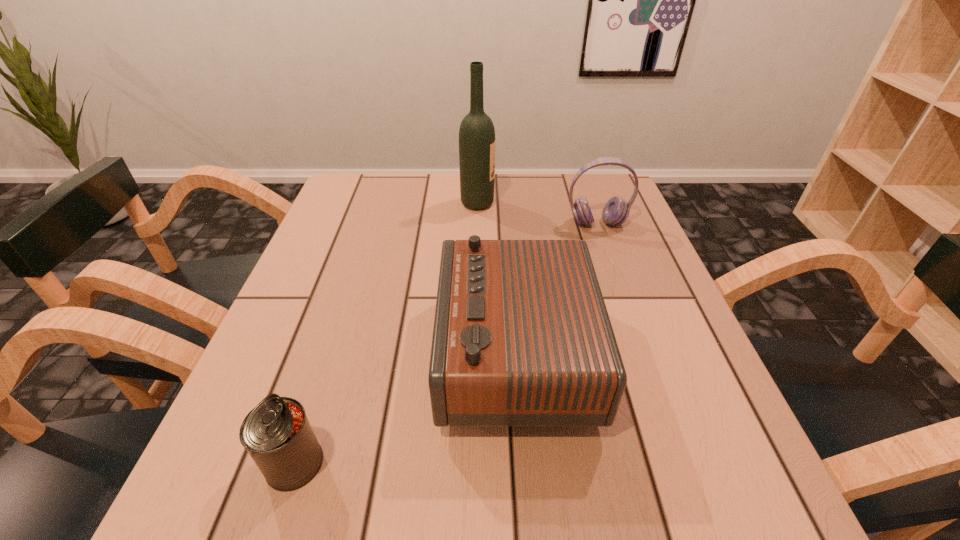
Identify the location of free spot located 0.320m on the front panel of the radio receiver. (263, 353).

Locate an element on the screen. This screenshot has width=960, height=540. free point located 0.060m on the headband and ear cups of the second farthest object is located at coordinates (605, 246).

You are a GUI agent. You are given a task and a screenshot of the screen. Output one action in this format:
    pyautogui.click(x=<x>, y=<y>)
    Task: Click on the free location located on the back of the can
    
    Given the screenshot: What is the action you would take?
    pyautogui.click(x=328, y=359)

Locate an element on the screen. wine bottle located at the far edge is located at coordinates (476, 134).

Locate an element on the screen. The width and height of the screenshot is (960, 540). headset that is at the far edge is located at coordinates (615, 212).

Identify the location of object at the near edge. (277, 434).

Where is `object that is at the left edge`? The width and height of the screenshot is (960, 540). object that is at the left edge is located at coordinates (277, 434).

Identify the location of object positioned at the right edge. This screenshot has height=540, width=960. (615, 212).

This screenshot has height=540, width=960. What are the coordinates of `object at the near left corner` in the screenshot? It's located at (277, 434).

Locate an element on the screen. object that is at the far right corner is located at coordinates (615, 212).